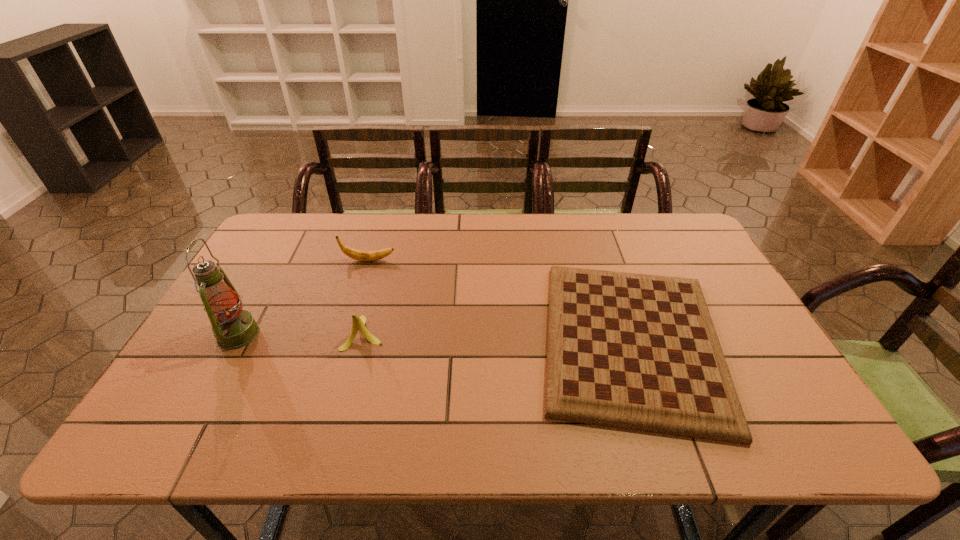
Locate an element on the screen. The image size is (960, 540). free area in between the nearer banana and the farthest object is located at coordinates (367, 296).

Locate an element on the screen. The width and height of the screenshot is (960, 540). free space between the tallest object and the nearer banana is located at coordinates (301, 334).

You are a GUI agent. You are given a task and a screenshot of the screen. Output one action in this format:
    pyautogui.click(x=<x>, y=<y>)
    Task: Click on the free space between the oil lamp and the nearer banana
    
    Given the screenshot: What is the action you would take?
    pyautogui.click(x=301, y=334)

The width and height of the screenshot is (960, 540). Find the location of `free space that is in between the farthest object and the nearer banana`. free space that is in between the farthest object and the nearer banana is located at coordinates (367, 296).

Where is `vacant area that lies between the farther banana and the leftmost object`? This screenshot has height=540, width=960. vacant area that lies between the farther banana and the leftmost object is located at coordinates (303, 298).

You are a GUI agent. You are given a task and a screenshot of the screen. Output one action in this format:
    pyautogui.click(x=<x>, y=<y>)
    Task: Click on the free space between the leftmost object and the rightmost object
    The width and height of the screenshot is (960, 540).
    Given the screenshot: What is the action you would take?
    pyautogui.click(x=435, y=338)

This screenshot has height=540, width=960. Find the location of `vacant area between the oil lamp and the shortest object`. vacant area between the oil lamp and the shortest object is located at coordinates (435, 338).

This screenshot has width=960, height=540. I want to click on free area in between the nearer banana and the farthest object, so click(x=367, y=296).

The image size is (960, 540). Identify the location of object that is the closest one to the nearer banana. (233, 328).

Identify which object is located as the nearest to the gameboard. Please provide its 2D coordinates. Your answer should be formatted as a tuple, i.e. [(x, y)], where the tuple contains the x and y coordinates of a point satisfying the conditions above.

[(358, 322)]